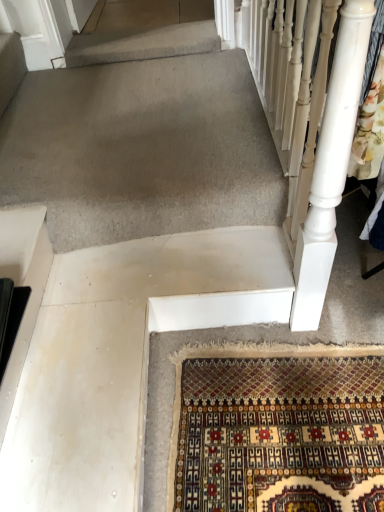
Locate an element on the screen. Image resolution: width=384 pixels, height=512 pixels. black plastic at left is located at coordinates (14, 323).

This screenshot has width=384, height=512. What do you see at coordinates (14, 323) in the screenshot? I see `black plastic at left` at bounding box center [14, 323].

What is the approximate width of black plastic at left?

The width of black plastic at left is 12.52 inches.

The height and width of the screenshot is (512, 384). Identify the location of white painted wood at right. 326,158.

The image size is (384, 512). What do you see at coordinates (326, 158) in the screenshot?
I see `white painted wood at right` at bounding box center [326, 158].

You are a GUI agent. You are given a task and a screenshot of the screen. Output one action in this format:
    pyautogui.click(x=<x>, y=<y>)
    Task: Click on the black plastic at left
    
    Given the screenshot: What is the action you would take?
    pyautogui.click(x=14, y=323)

Can you confirm if white painted wood at right is positioned to the right of black plastic at left?

Correct, you'll find white painted wood at right to the right of black plastic at left.

Considering the relative positions of white painted wood at right and black plastic at left in the image provided, is white painted wood at right in front of black plastic at left?

Yes, it is in front of black plastic at left.

Which is less distant, (331, 140) or (5, 368)?

Point (331, 140).

From the image's perspective, is white painted wood at right positioned above or below black plastic at left?

white painted wood at right is above black plastic at left.

From a real-world perspective, who is located higher, white painted wood at right or black plastic at left?

white painted wood at right.

Considering the sizes of white painted wood at right and black plastic at left in the image, is white painted wood at right wider or thinner than black plastic at left?

Clearly, white painted wood at right has less width compared to black plastic at left.

Considering the relative sizes of white painted wood at right and black plastic at left in the image provided, is white painted wood at right shorter than black plastic at left?

Incorrect, the height of white painted wood at right does not fall short of that of black plastic at left.

Does white painted wood at right have a larger size compared to black plastic at left?

Yes, white painted wood at right is bigger than black plastic at left.

Would you say white painted wood at right is outside black plastic at left?

Indeed, white painted wood at right is completely outside black plastic at left.

From the picture: Would you consider white painted wood at right to be distant from black plastic at left?

No, white painted wood at right is in close proximity to black plastic at left.

Is white painted wood at right facing away from black plastic at left?

No, white painted wood at right's orientation is not away from black plastic at left.

At what (x,y) coordinates should I click in order to perform the action: click on stairs directly beneath the white painted wood at right (from a real-world perspective). Please return your answer as a coordinate pair (x, y). This screenshot has width=384, height=512. Looking at the image, I should click on (14, 323).

Between black plastic at left and white painted wood at right, which one appears on the left side from the viewer's perspective?

Positioned to the left is black plastic at left.

Based on the photo, is the depth of black plastic at left greater than that of white painted wood at right?

Yes, the depth of black plastic at left is greater than that of white painted wood at right.

Which point is more forward, (15, 304) or (259, 36)?

The point (15, 304) is in front.

From the image's perspective, which one is positioned lower, black plastic at left or white painted wood at right?

black plastic at left.

From a real-world perspective, is black plastic at left above or below white painted wood at right?

black plastic at left is below white painted wood at right.

Which object is wider, black plastic at left or white painted wood at right?

black plastic at left.

Who is taller, black plastic at left or white painted wood at right?

With more height is white painted wood at right.

Which of these two, black plastic at left or white painted wood at right, is bigger?

With larger size is white painted wood at right.

Is black plastic at left spatially inside white painted wood at right, or outside of it?

black plastic at left is not enclosed by white painted wood at right.

Is black plastic at left far from white painted wood at right?

No, black plastic at left is not far away from white painted wood at right.

Is black plastic at left positioned with its back to white painted wood at right?

black plastic at left is not turned away from white painted wood at right.

How many degrees apart are the facing directions of black plastic at left and white painted wood at right?

177 degrees separate the facing orientations of black plastic at left and white painted wood at right.

Measure the distance between black plastic at left and white painted wood at right.

black plastic at left and white painted wood at right are 37.29 inches apart from each other.

Where is `rail lying on the right of black plastic at left`? rail lying on the right of black plastic at left is located at coordinates (x=326, y=158).

The height and width of the screenshot is (512, 384). What are the coordinates of `rail in front of the black plastic at left` in the screenshot? It's located at (326, 158).

You are a GUI agent. You are given a task and a screenshot of the screen. Output one action in this format:
    pyautogui.click(x=<x>, y=<y>)
    Task: Click on the stairs below the white painted wood at right (from the image's perspective)
    This screenshot has height=512, width=384.
    Given the screenshot: What is the action you would take?
    pyautogui.click(x=14, y=323)